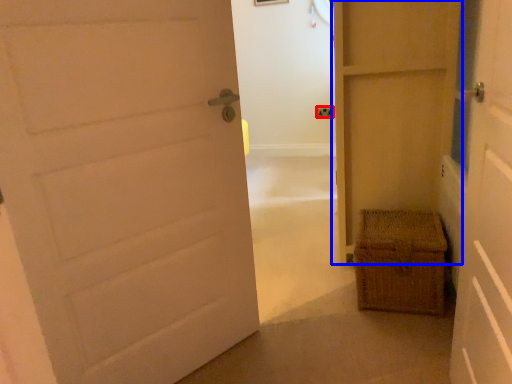
Question: Among these objects, which one is farthest to the camera, electric outlet (highlighted by a red box) or door (highlighted by a blue box)?

Choices:
 (A) electric outlet
 (B) door

Answer: (A)